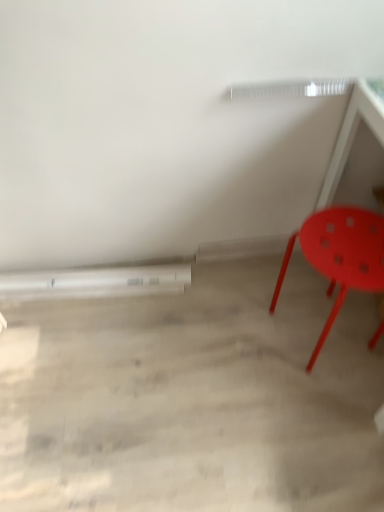
You are a GUI agent. You are given a task and a screenshot of the screen. Output one action in this format:
    pyautogui.click(x=<x>, y=<y>)
    Task: Click on the vacant space situated above matte plastic chair at right (from a real-world perspective)
    The width and height of the screenshot is (384, 512).
    Given the screenshot: What is the action you would take?
    pyautogui.click(x=346, y=240)